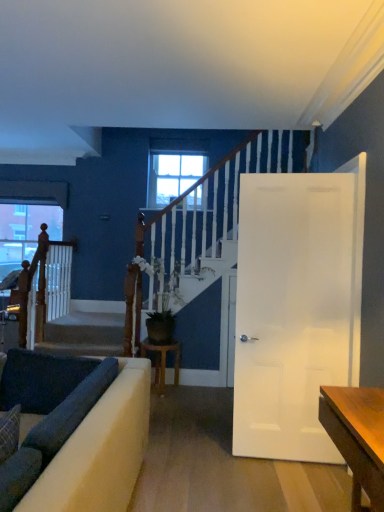
You are a GUI agent. You are given a task and a screenshot of the screen. Output one action in this format:
    pyautogui.click(x=<x>, y=<y>)
    Task: Click on the free location to the left of white glossy door at right
    The image size is (384, 512).
    Given the screenshot: What is the action you would take?
    pyautogui.click(x=216, y=463)